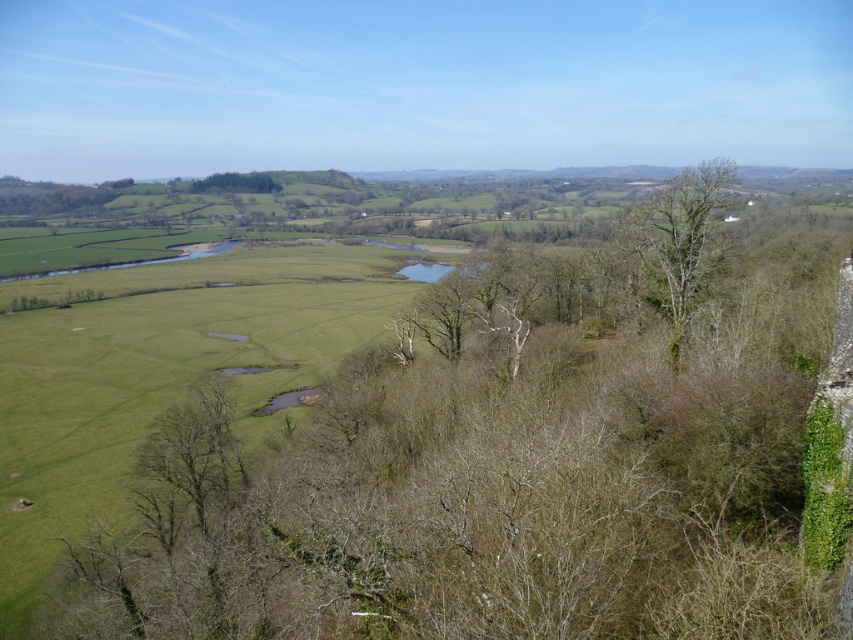
Question: Which point is farther to the camera?

Choices:
 (A) (672, 300)
 (B) (650, 403)

Answer: (A)

Question: Can you confirm if bare branches at center is bigger than bare wood tree at right?

Choices:
 (A) yes
 (B) no

Answer: (A)

Question: Where is bare branches at center located in relation to bare wood tree at right in the image?

Choices:
 (A) below
 (B) above

Answer: (A)

Question: Does bare branches at center have a larger size compared to bare wood tree at right?

Choices:
 (A) yes
 (B) no

Answer: (A)